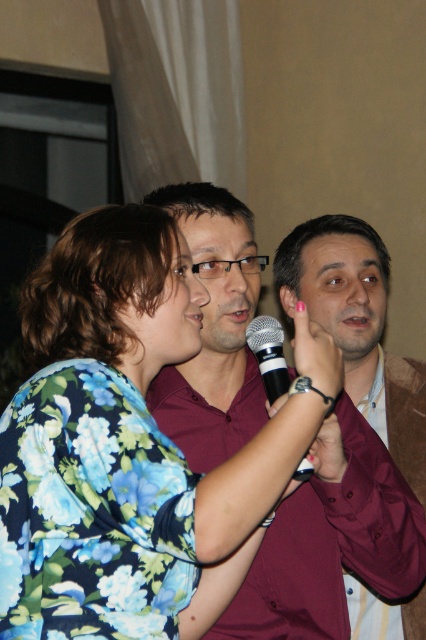
You are a photographer at the event and want to ensure both the floral fabric shirt at center and the maroon shirt at center are visible in the photo. Which shirt should you focus on to capture both in frame without cropping?

The floral fabric shirt at center has a lesser height compared to maroon shirt at center. Therefore, focusing on the maroon shirt at center would allow both shirts to be visible as it is taller and can serve as a central point.

You are standing at the camera position and want to know how far the point at coordinates (48, 496) is from you. Can you determine the distance?

The distance between the point at coordinates (48, 496) and the camera is 3.91 feet.

You are a photographer at the event and need to capture a closeup shot of the maroon shirt at center and the black matte microphone at center. The camera you are using has a minimum focusing distance of 20 centimeters. Will you be able to take the photo without moving closer?

The maroon shirt at center is 19.66 centimeters away from the black matte microphone at center. Since the minimum focusing distance is 20 centimeters, the camera cannot focus at this distance. You need to move slightly further back to ensure the subjects are within the minimum focusing range.